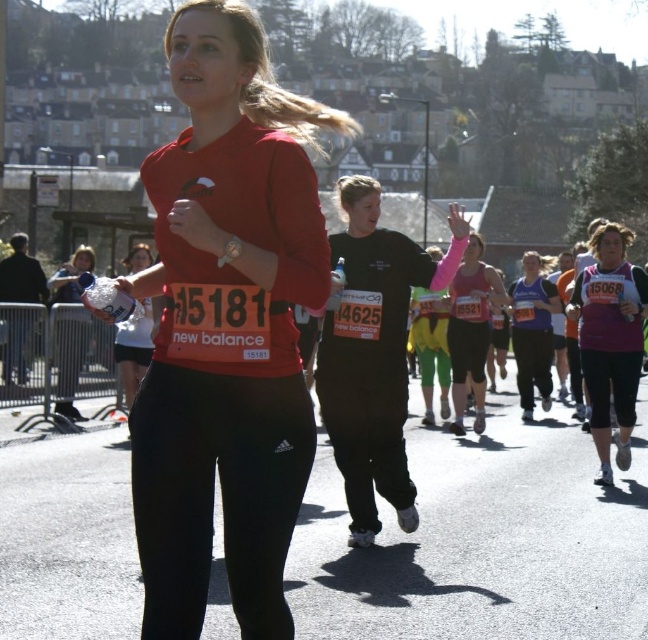
In the scene shown: Between pink matte tank top at center and matte purple tank top at center, which one is positioned lower?

matte purple tank top at center

Does pink matte tank top at center appear on the left side of matte purple tank top at center?

Yes, pink matte tank top at center is to the left of matte purple tank top at center.

Locate an element on the screen. pink matte tank top at center is located at coordinates (470, 330).

Is point (297, 248) behind point (491, 278)?

No.

You are a GUI agent. You are given a task and a screenshot of the screen. Output one action in this format:
    pyautogui.click(x=<x>, y=<y>)
    Task: Click on the matte red shirt at center
    The width and height of the screenshot is (648, 640).
    Given the screenshot: What is the action you would take?
    point(226,328)

The width and height of the screenshot is (648, 640). Identify the location of matte red shirt at center. (226, 328).

Between matte purple tank top at center and matte black leggings at center, which one has more height?

matte black leggings at center is taller.

Who is higher up, matte purple tank top at center or matte black leggings at center?

matte black leggings at center is above.

Locate an element on the screen. The height and width of the screenshot is (640, 648). matte purple tank top at center is located at coordinates (533, 332).